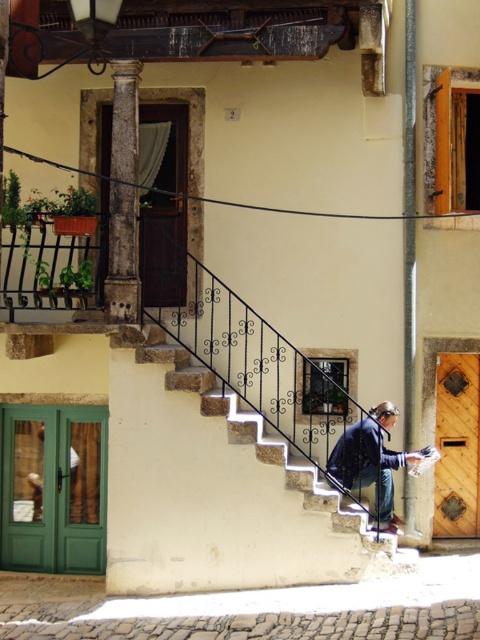
You are standing at the base of the stairs in front of the residential building. You notice a point marked at coordinates (123, 196). Which object does this point correspond to?

The point at coordinates (123, 196) corresponds to the rustic stone column at left.

You are standing at the base of the stairs in front of the residential building. You need to locate the black wrought iron at upper left. According to the coordinate system where the bottom left corner is the origin, can you determine if it is positioned above the 0.428 x coordinate and to the left of the 0.098 y coordinate?

The black wrought iron at upper left is located at point (x=47, y=273). Since the coordinate system has the origin at the bottom left corner, the x coordinate increases to the right and the y coordinate increases upward. Therefore, the black wrought iron at upper left is exactly at the specified coordinates, not above or to the left of them.